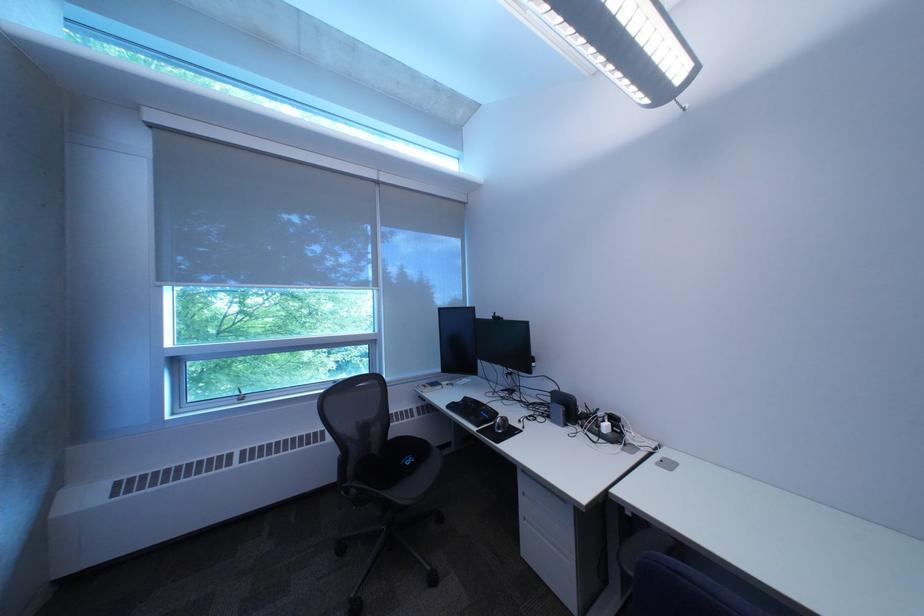
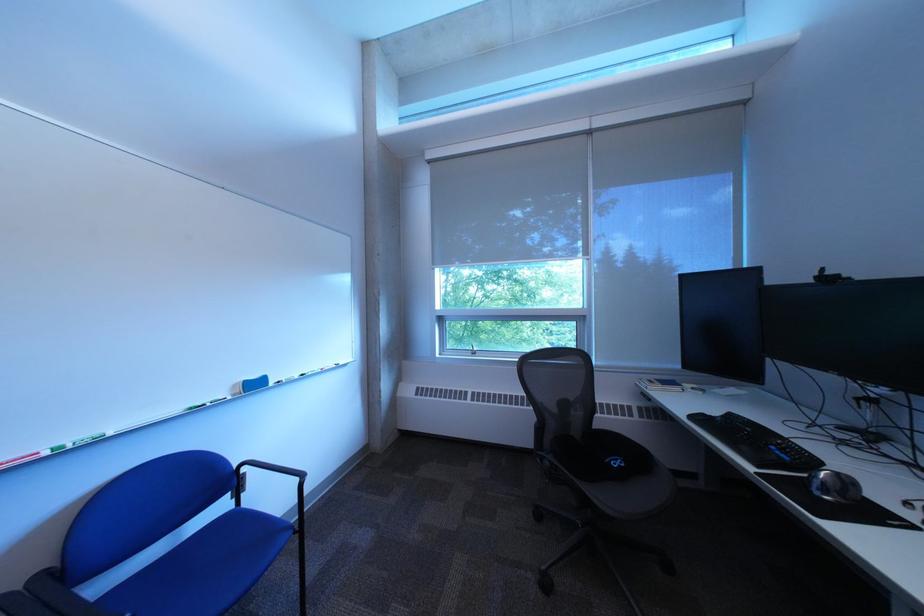
Find the pixel in the second image that matches the point at 512,317 in the first image.

(843, 275)